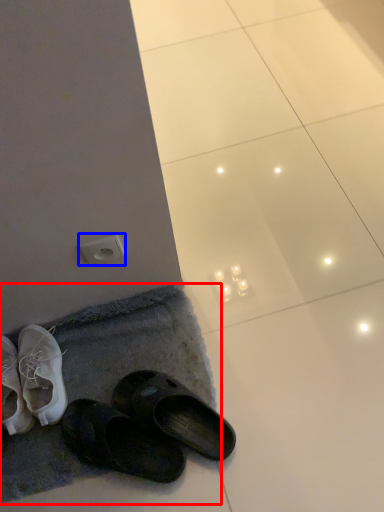
Question: Which of the following is the closest to the observer, bath mat (highlighted by a red box) or electric outlet (highlighted by a blue box)?

Choices:
 (A) bath mat
 (B) electric outlet

Answer: (B)